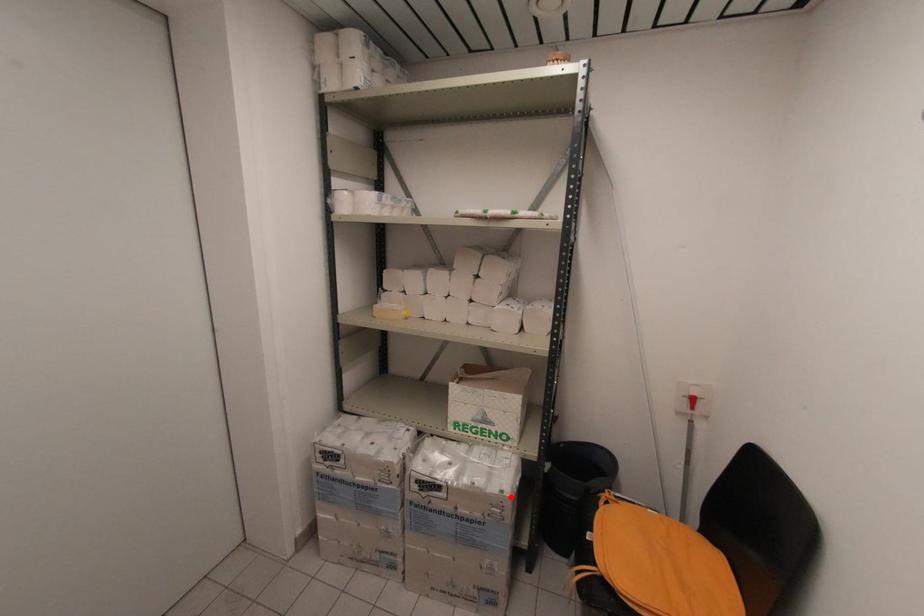
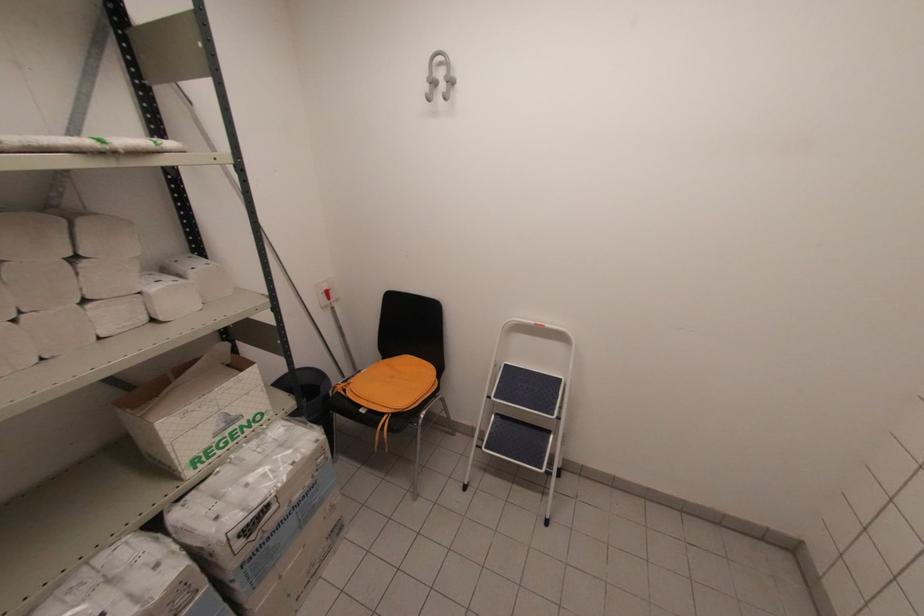
Find the pixel in the second image that matches the highlighted location in the first image.

(325, 437)